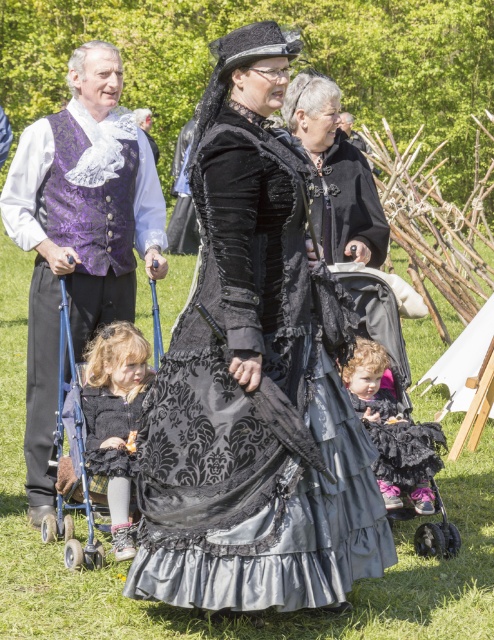
From the picture: Does black lace baby carriage at center have a smaller size compared to black lace dress at center?

Actually, black lace baby carriage at center might be larger than black lace dress at center.

Who is more forward, (408,364) or (394,422)?

Point (394,422)

At what (x,y) coordinates should I click in order to perform the action: click on black lace baby carriage at center. Please return your answer as a coordinate pair (x, y). This screenshot has height=640, width=494. Looking at the image, I should click on (396, 416).

Where is `black lace baby carriage at center`? black lace baby carriage at center is located at coordinates (396, 416).

In the scene shown: Does purple brocade vest at left appear under metallic blue baby carriage at lower left?

Actually, purple brocade vest at left is above metallic blue baby carriage at lower left.

You are a GUI agent. You are given a task and a screenshot of the screen. Output one action in this format:
    pyautogui.click(x=<x>, y=<y>)
    Task: Click on the purple brocade vest at left
    The height and width of the screenshot is (640, 494).
    Given the screenshot: What is the action you would take?
    pyautogui.click(x=79, y=234)

I want to click on purple brocade vest at left, so click(79, 234).

Does black velvet dress at center have a lesser width compared to black lace baby carriage at center?

Incorrect, black velvet dress at center's width is not less than black lace baby carriage at center's.

Is black velvet dress at center below black lace baby carriage at center?

No.

This screenshot has width=494, height=640. Describe the element at coordinates (251, 412) in the screenshot. I see `black velvet dress at center` at that location.

You are a GUI agent. You are given a task and a screenshot of the screen. Output one action in this format:
    pyautogui.click(x=<x>, y=<y>)
    Task: Click on the black velvet dress at center
    Image resolution: width=494 pixels, height=640 pixels.
    Given the screenshot: What is the action you would take?
    pyautogui.click(x=251, y=412)